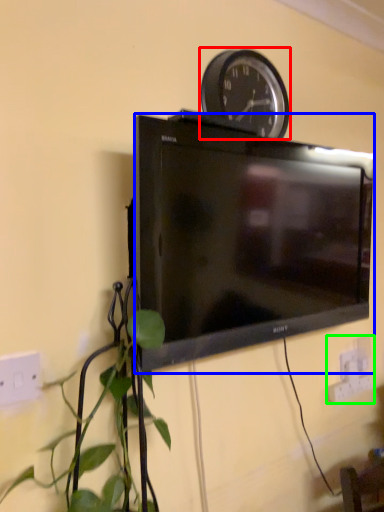
Question: Based on their relative distances, which object is farther from wall clock (highlighted by a red box)? Choose from television (highlighted by a blue box) and electric outlet (highlighted by a green box).

Choices:
 (A) television
 (B) electric outlet

Answer: (B)